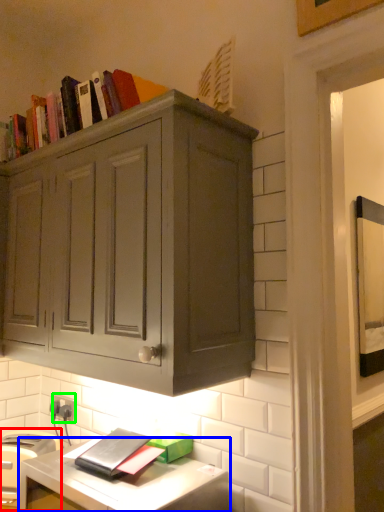
Question: Estimate the real-world distances between objects in this image. Which object is closer to appliance (highlighted by a red box), computer desk (highlighted by a blue box) or electric outlet (highlighted by a green box)?

Choices:
 (A) computer desk
 (B) electric outlet

Answer: (A)